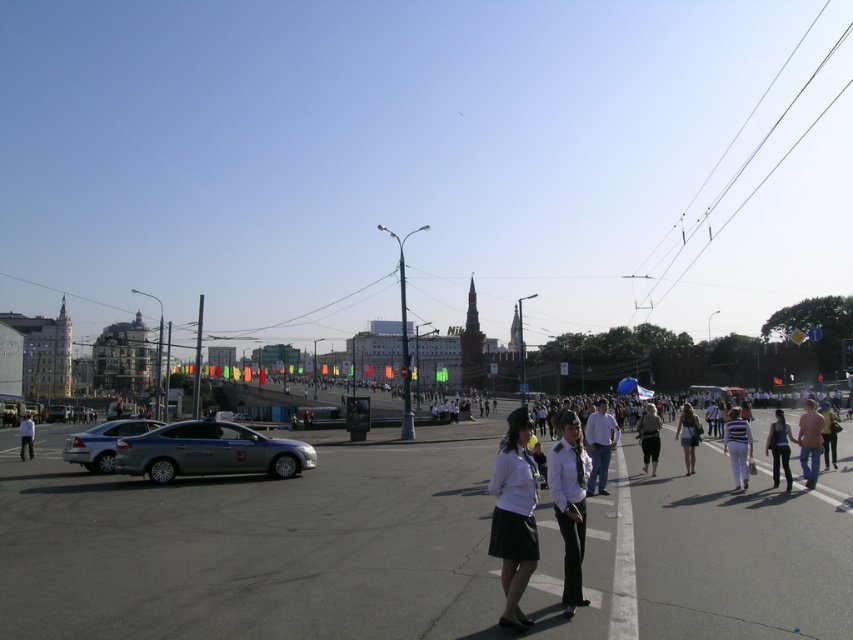
Question: Which object appears farthest from the camera in this image?

Choices:
 (A) white shirt and black skirt at center
 (B) light brown leather jacket at lower right
 (C) smooth asphalt road at center

Answer: (A)

Question: Can you confirm if silver metallic sedan at center-left is positioned below white striped shirt at center?

Choices:
 (A) yes
 (B) no

Answer: (A)

Question: Does white uniform at center come in front of white shirt and black skirt at center?

Choices:
 (A) no
 (B) yes

Answer: (B)

Question: Which of the following is the closest to the observer?

Choices:
 (A) (807, 444)
 (B) (779, 458)
 (C) (579, 486)
 (D) (659, 440)

Answer: (C)

Question: Which object is farther from the camera taking this photo?

Choices:
 (A) black matte tank top at center
 (B) light brown leather jacket at lower right

Answer: (B)

Question: Is pink fabric shirt at lower right bigger than white striped shirt at center?

Choices:
 (A) yes
 (B) no

Answer: (A)